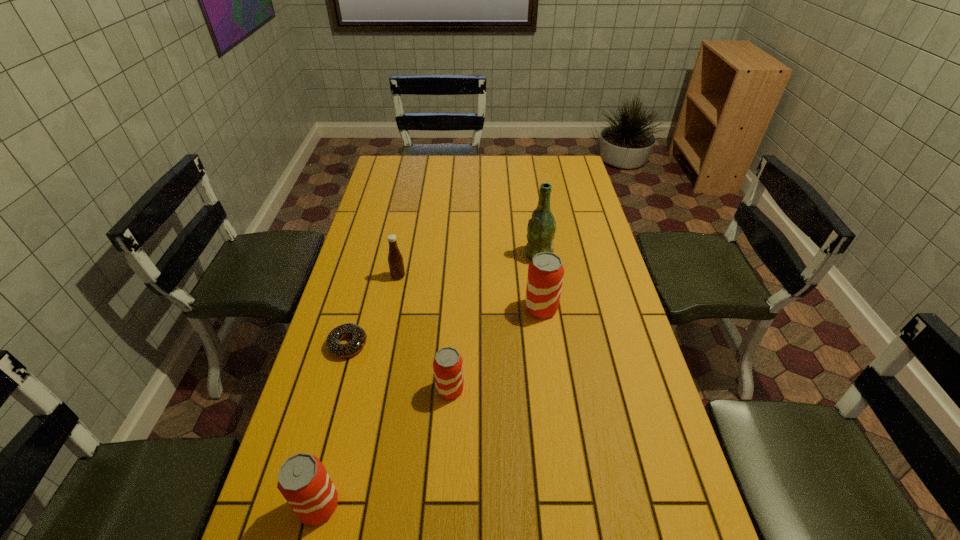
Find the location of a particular element. The image size is (960, 540). the nearest beer can is located at coordinates (303, 480).

The image size is (960, 540). I want to click on the leftmost beer can, so click(303, 480).

The width and height of the screenshot is (960, 540). Find the location of `the shortest beer can`. the shortest beer can is located at coordinates (448, 364).

Where is `the second beer can from left to right`? the second beer can from left to right is located at coordinates (448, 364).

Locate an element on the screen. This screenshot has width=960, height=540. the farthest beer can is located at coordinates (545, 276).

I want to click on the third farthest object, so click(x=545, y=276).

Where is `the fourth farthest object`? The height and width of the screenshot is (540, 960). the fourth farthest object is located at coordinates (333, 345).

I want to click on doughnut, so click(333, 345).

Locate an element on the screen. The image size is (960, 540). the fourth object from right to left is located at coordinates (395, 260).

You are a GUI agent. You are given a task and a screenshot of the screen. Output one action in this format:
    pyautogui.click(x=<x>, y=<y>)
    Task: Click on the fifth nearest object
    The image size is (960, 540).
    Given the screenshot: What is the action you would take?
    pyautogui.click(x=395, y=260)